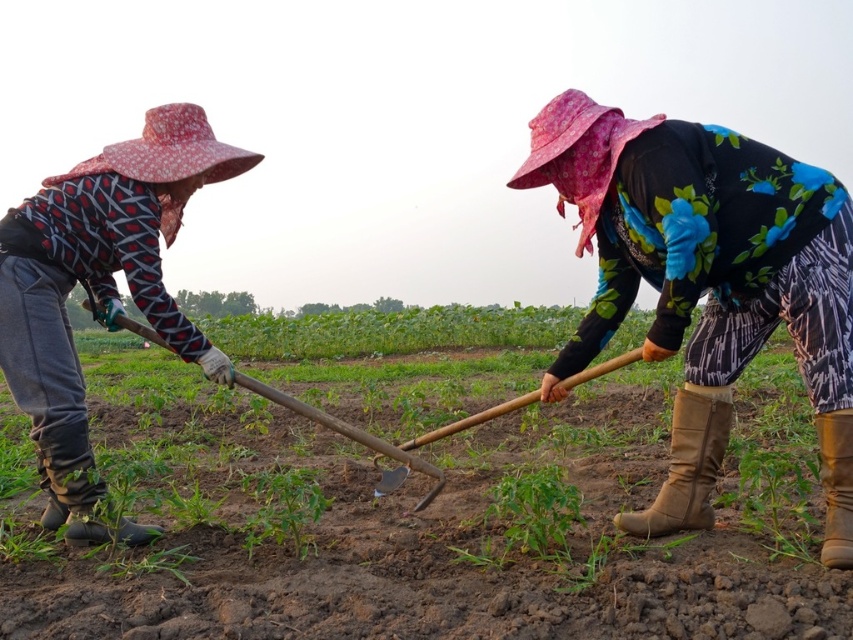
You are standing at the center of the field and need to determine the distance between the matte black shirt at left and the brown leather boot at lower right. Based on the scene, can you estimate how far apart they are?

The matte black shirt at left is 6.41 feet away from the brown leather boot at lower right, so they are approximately 6.41 feet apart.

You are standing at the camera position and want to hand a tool to the matte black shirt at left. Considering the distance, can you comfortably reach them without moving closer?

The distance between the matte black shirt at left and the camera is 2.48 meters, so you cannot comfortably reach them without moving closer.

You are standing at the bottom edge of the image. You want to move towards the black rubber boot at lower left. Which direction should you walk? Please answer with a single word like left, right, forward, backward, etc.

The black rubber boot at lower left is located at point 0.767 on the x axis and 0.095 on the y axis. Since you are at the bottom edge, which is the lowest y value, moving forward would increase your y coordinate. To reach the boot, you should move forward because the boot is already at the lower left part of the image. However, since the boot is at lower left, you might also need to move slightly to the left if not already aligned. But since the question asks for direction from the bottom edge, the primary